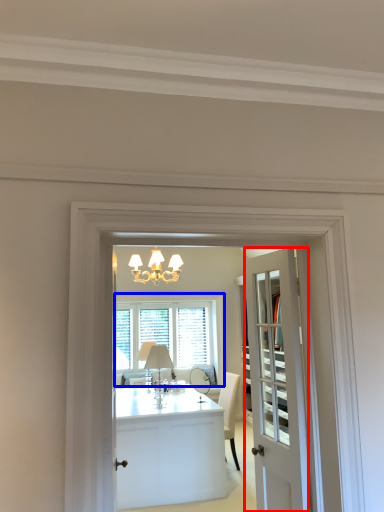
Question: Which object appears closest to the camera in this image, door (highlighted by a red box) or window (highlighted by a blue box)?

Choices:
 (A) door
 (B) window

Answer: (A)